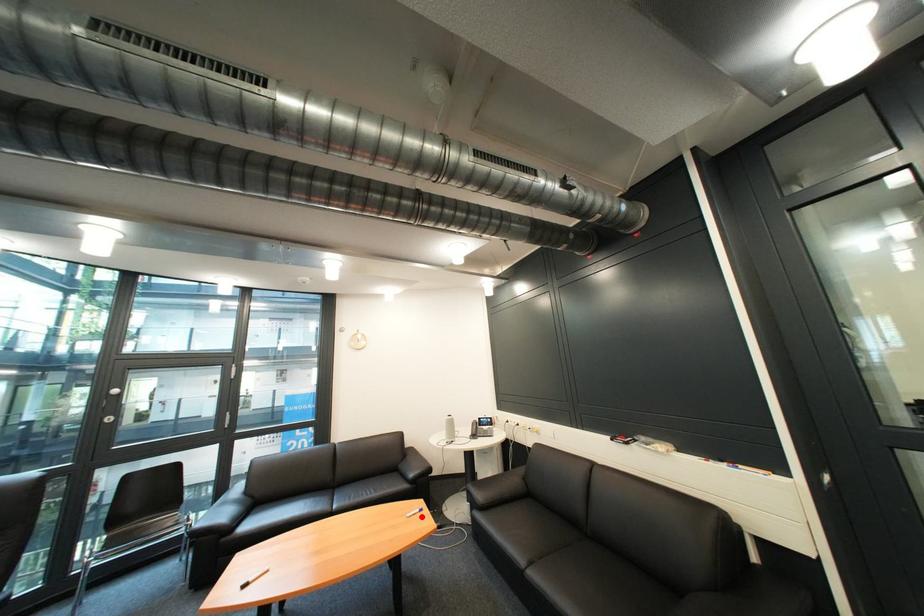
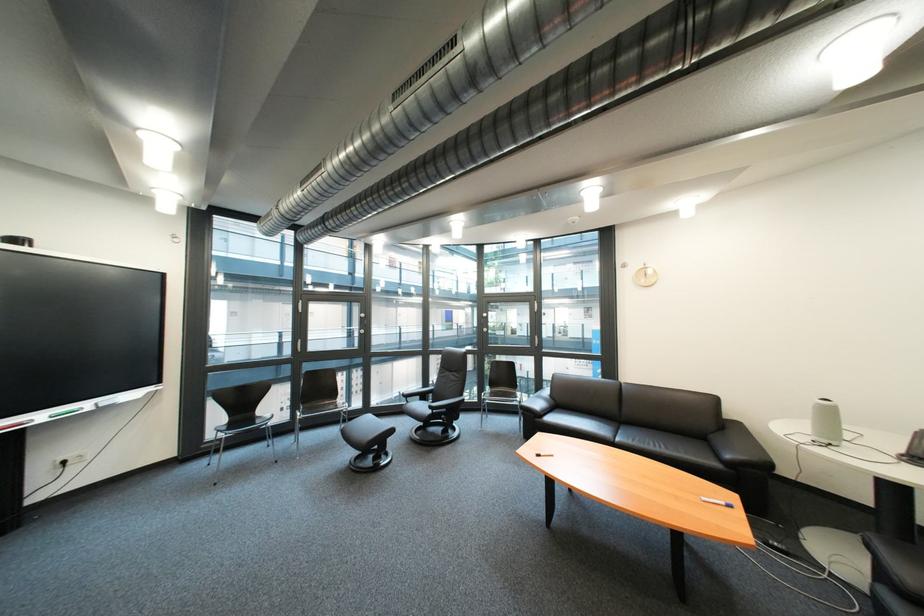
Question: I am providing you with two images of the same scene from different viewpoints. Given a red point in image1, look at the same physical point in image2. Is it:

Choices:
 (A) Closer to the viewpoint
 (B) Farther from the viewpoint

Answer: (B)